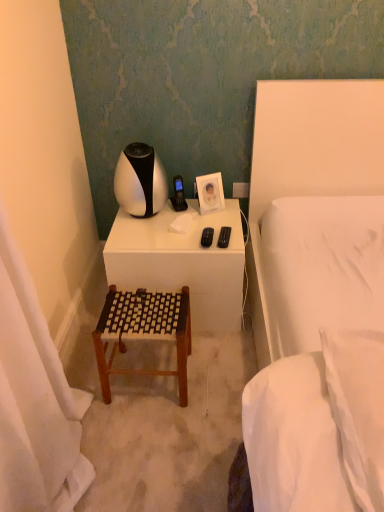
Question: Is white fabric curtain at left smaller than white soft pillow at right?

Choices:
 (A) yes
 (B) no

Answer: (A)

Question: Can you confirm if white fabric curtain at left is bigger than white soft pillow at right?

Choices:
 (A) yes
 (B) no

Answer: (B)

Question: Does white fabric curtain at left have a greater width compared to white soft pillow at right?

Choices:
 (A) no
 (B) yes

Answer: (A)

Question: From a real-world perspective, is white fabric curtain at left physically below white soft pillow at right?

Choices:
 (A) yes
 (B) no

Answer: (A)

Question: Is white soft pillow at right located within white fabric curtain at left?

Choices:
 (A) yes
 (B) no

Answer: (B)

Question: Would you say white matte desk at center is inside or outside white soft pillow at right?

Choices:
 (A) inside
 (B) outside

Answer: (B)

Question: Is point (120, 216) positioned closer to the camera than point (357, 347)?

Choices:
 (A) farther
 (B) closer

Answer: (A)

Question: Looking at the image, does white matte desk at center seem bigger or smaller compared to white soft pillow at right?

Choices:
 (A) small
 (B) big

Answer: (B)

Question: Is white matte desk at center wider or thinner than white soft pillow at right?

Choices:
 (A) wide
 (B) thin

Answer: (A)

Question: In terms of height, does brown woven stool at center look taller or shorter compared to white fabric curtain at left?

Choices:
 (A) short
 (B) tall

Answer: (B)

Question: Does point (125, 308) appear closer or farther from the camera than point (64, 448)?

Choices:
 (A) closer
 (B) farther

Answer: (B)

Question: In the image, is brown woven stool at center positioned in front of or behind white fabric curtain at left?

Choices:
 (A) behind
 (B) front

Answer: (A)

Question: From the image's perspective, is brown woven stool at center located above or below white fabric curtain at left?

Choices:
 (A) above
 (B) below

Answer: (A)

Question: Relative to brown woven stool at center, is white matte desk at center in front or behind?

Choices:
 (A) behind
 (B) front

Answer: (A)

Question: Do you think white matte desk at center is within brown woven stool at center, or outside of it?

Choices:
 (A) inside
 (B) outside

Answer: (B)